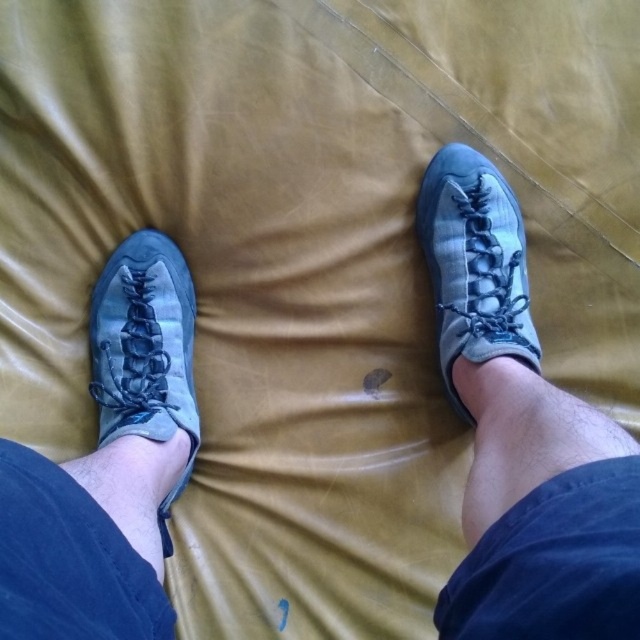
Does matte blue fabric shoe at right have a greater height compared to matte gray shoe at left?

No.

Which is more to the right, matte blue fabric shoe at right or matte gray shoe at left?

Positioned to the right is matte blue fabric shoe at right.

At what (x,y) coordinates should I click in order to perform the action: click on matte blue fabric shoe at right. Please return your answer as a coordinate pair (x, y). The height and width of the screenshot is (640, 640). Looking at the image, I should click on 474,262.

Image resolution: width=640 pixels, height=640 pixels. Identify the location of matte blue fabric shoe at right. (474, 262).